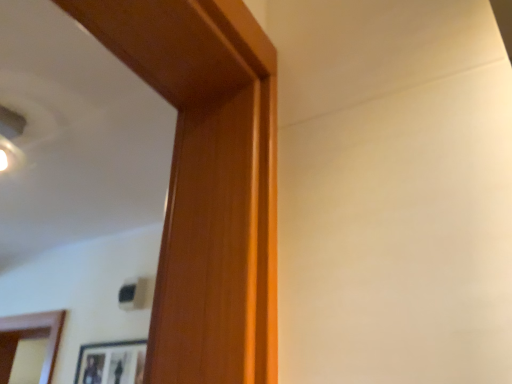
Locate an element on the screen. wooden door at upper left is located at coordinates (207, 182).

What do you see at coordinates (207, 182) in the screenshot?
I see `wooden door at upper left` at bounding box center [207, 182].

At what (x,y) coordinates should I click in order to perform the action: click on wooden door at upper left. Please return your answer as a coordinate pair (x, y). The height and width of the screenshot is (384, 512). Looking at the image, I should click on (207, 182).